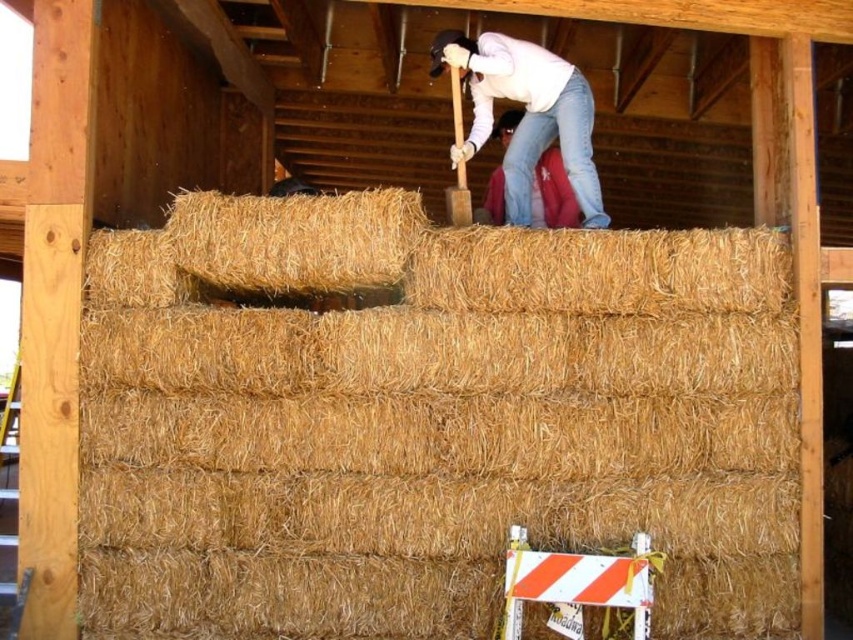
Question: Which point is closer to the camera?

Choices:
 (A) (523, 52)
 (B) (480, 208)

Answer: (A)

Question: From the image, what is the correct spatial relationship of brown straw bale at upper center in relation to matte white shirt at upper center?

Choices:
 (A) left
 (B) right

Answer: (A)

Question: Which object appears closest to the camera in this image?

Choices:
 (A) brown straw bale at upper center
 (B) dry straw bale at upper center
 (C) jeans at upper center
 (D) matte white shirt at upper center

Answer: (A)

Question: Which of the following is the farthest from the observer?

Choices:
 (A) matte white shirt at upper center
 (B) dry straw bale at upper center

Answer: (A)

Question: Is dry straw bale at upper center bigger than matte white shirt at upper center?

Choices:
 (A) yes
 (B) no

Answer: (B)

Question: Does dry straw bale at upper center have a smaller size compared to matte white shirt at upper center?

Choices:
 (A) no
 (B) yes

Answer: (B)